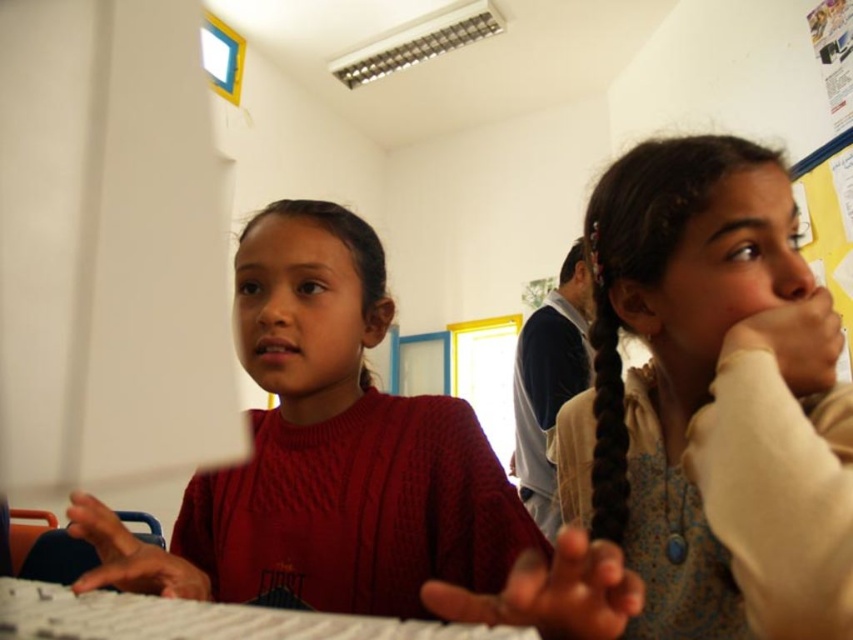
Looking at this image, you are a student trying to decide whether to place a new notebook between the light brown textured sweater at right and the white plastic keyboard at center on the desk. Based on their sizes, will there be enough space?

The light brown textured sweater at right is thinner than the white plastic keyboard at center, so there should be enough space to place the notebook between them.

You are a teacher observing the classroom scene. You notice the light brown textured sweater at right and the white plastic keyboard at center. Can you determine if the sweater is covering any part of the keyboard?

The light brown textured sweater at right is positioned over white plastic keyboard at center, so yes, the sweater is covering part of the keyboard.